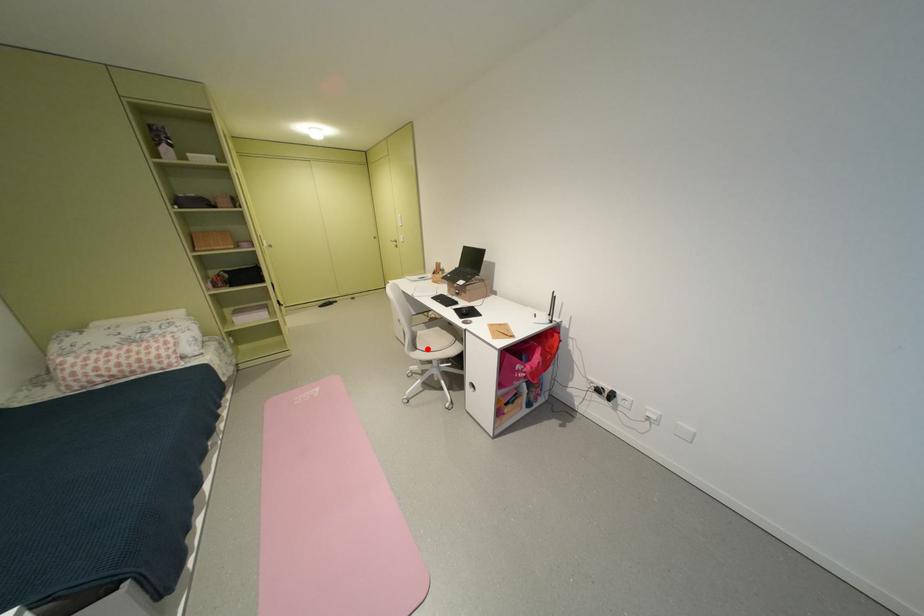
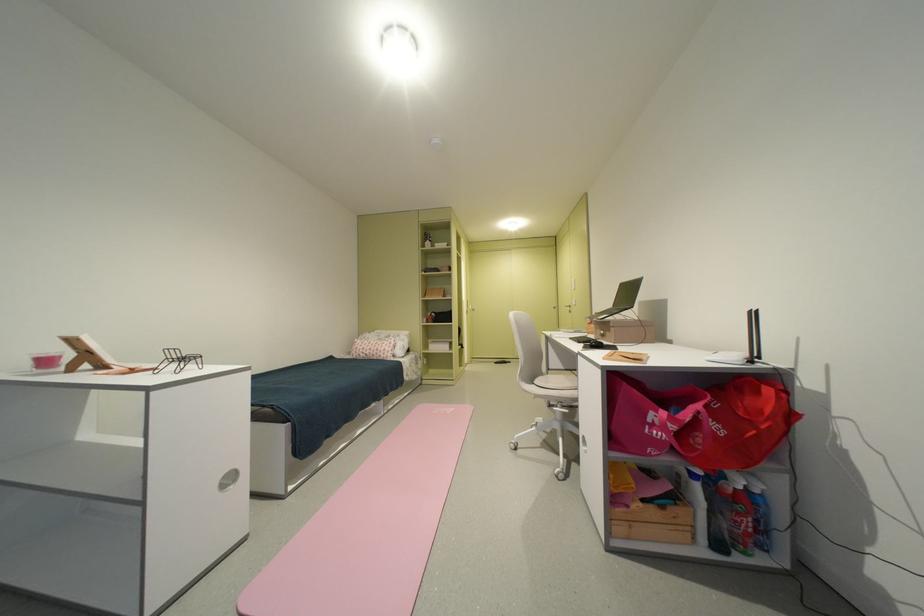
Question: I am providing you with two images of the same scene from different viewpoints. In image1, a red point is highlighted. Considering the same 3D point in image2, which of the following is correct?

Choices:
 (A) It is closer
 (B) It is farther

Answer: (B)